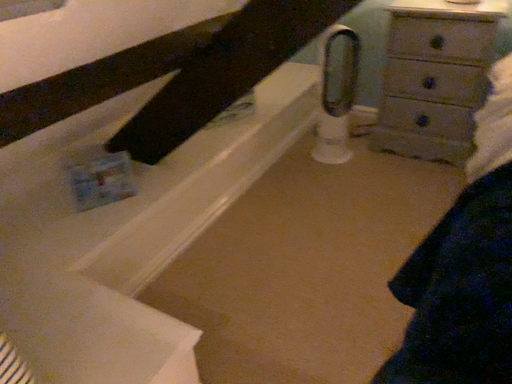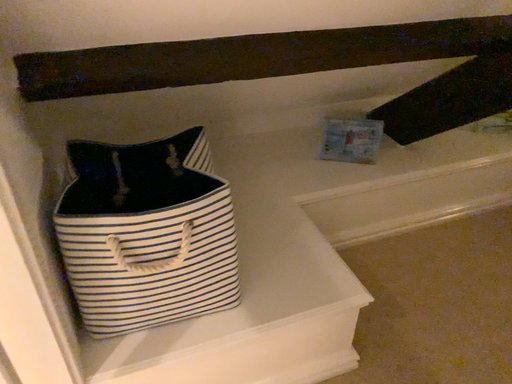
Question: Which way did the camera rotate in the video?

Choices:
 (A) rotated left
 (B) rotated right

Answer: (A)